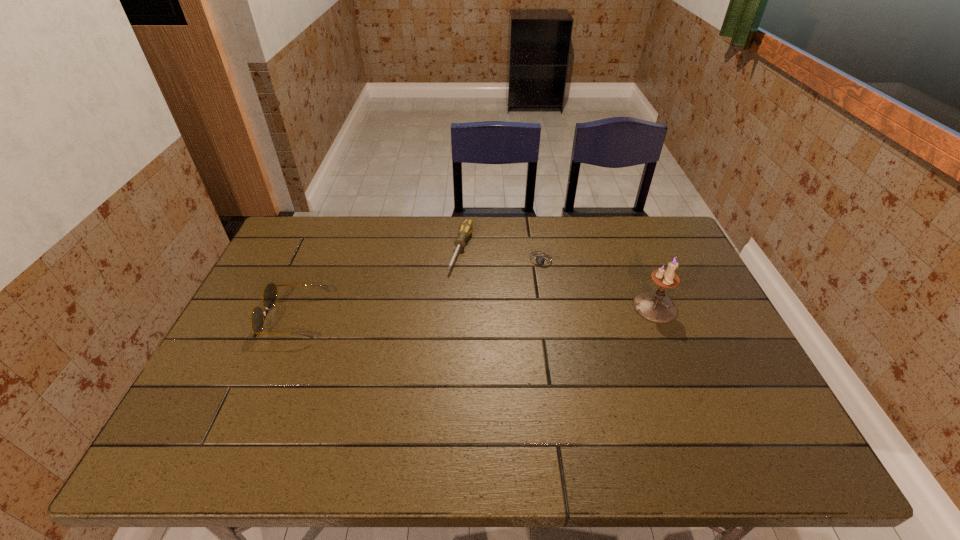
Locate an element on the screen. The height and width of the screenshot is (540, 960). vacant space at the near edge of the desktop is located at coordinates (677, 389).

In the image, there is a desktop. At what (x,y) coordinates should I click in order to perform the action: click on vacant space at the left edge. Please return your answer as a coordinate pair (x, y). The height and width of the screenshot is (540, 960). Looking at the image, I should click on (246, 377).

This screenshot has width=960, height=540. In the image, there is a desktop. Identify the location of free space at the right edge. (693, 274).

The height and width of the screenshot is (540, 960). I want to click on vacant area that lies between the candle holder and the leftmost object, so point(475,313).

This screenshot has height=540, width=960. I want to click on vacant area that lies between the second tallest object and the screwdriver, so click(378, 284).

The image size is (960, 540). I want to click on free space between the screwdriver and the watch, so click(x=502, y=255).

Locate an element on the screen. vacant area between the rightmost object and the third tallest object is located at coordinates (559, 278).

At what (x,y) coordinates should I click in order to perform the action: click on free spot between the shortest object and the leftmost object. Please return your answer as a coordinate pair (x, y). Looking at the image, I should click on 419,289.

Locate an element on the screen. free spot between the third object from right to left and the shortest object is located at coordinates (502, 255).

I want to click on unoccupied position between the shortest object and the candle holder, so click(599, 284).